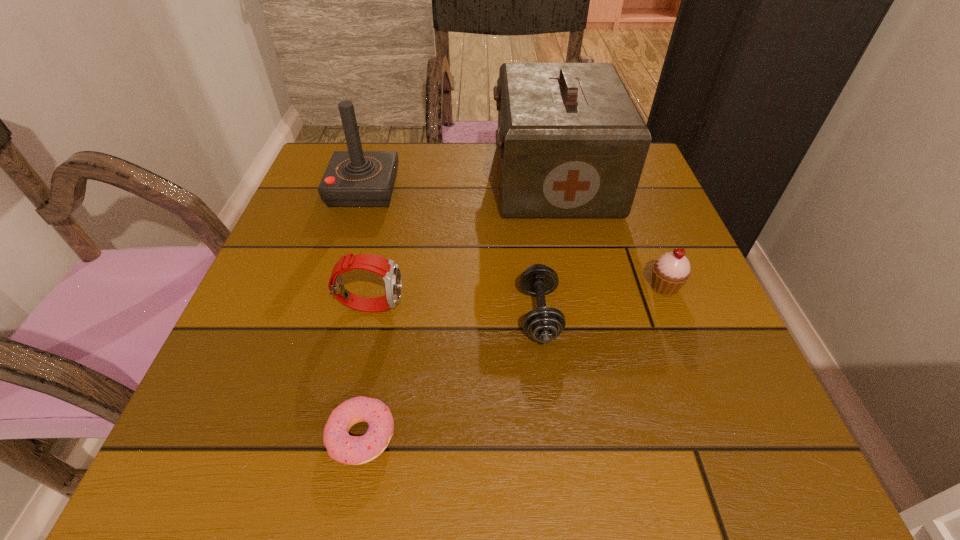
Find the location of a particular element. This screenshot has height=540, width=960. empty space between the fifth tallest object and the first-aid kit is located at coordinates [x=547, y=246].

Where is `free space between the watch and the dumbbell`? The height and width of the screenshot is (540, 960). free space between the watch and the dumbbell is located at coordinates (455, 309).

Where is `empty space between the dumbbell and the fourth shortest object`? empty space between the dumbbell and the fourth shortest object is located at coordinates (455, 309).

The image size is (960, 540). What are the coordinates of `empty location between the second shortest object and the fourth tallest object` in the screenshot? It's located at (602, 301).

At what (x,y) coordinates should I click in order to perform the action: click on vacant area that lies between the fourth tallest object and the second tallest object. Please return your answer as a coordinate pair (x, y). This screenshot has width=960, height=540. Looking at the image, I should click on (515, 238).

Where is `free spot between the cupcake and the first-aid kit`? Image resolution: width=960 pixels, height=540 pixels. free spot between the cupcake and the first-aid kit is located at coordinates (610, 232).

Where is `free space between the first-aid kit and the shortest object`? The image size is (960, 540). free space between the first-aid kit and the shortest object is located at coordinates (458, 307).

Find the location of `empty space that is in between the dumbbell and the second tallest object`. empty space that is in between the dumbbell and the second tallest object is located at coordinates (452, 252).

This screenshot has width=960, height=540. What are the coordinates of `vacant region between the first-aid kit and the fourth tallest object` in the screenshot? It's located at (610, 232).

Identify the location of free space between the cupcake and the joystick. (515, 238).